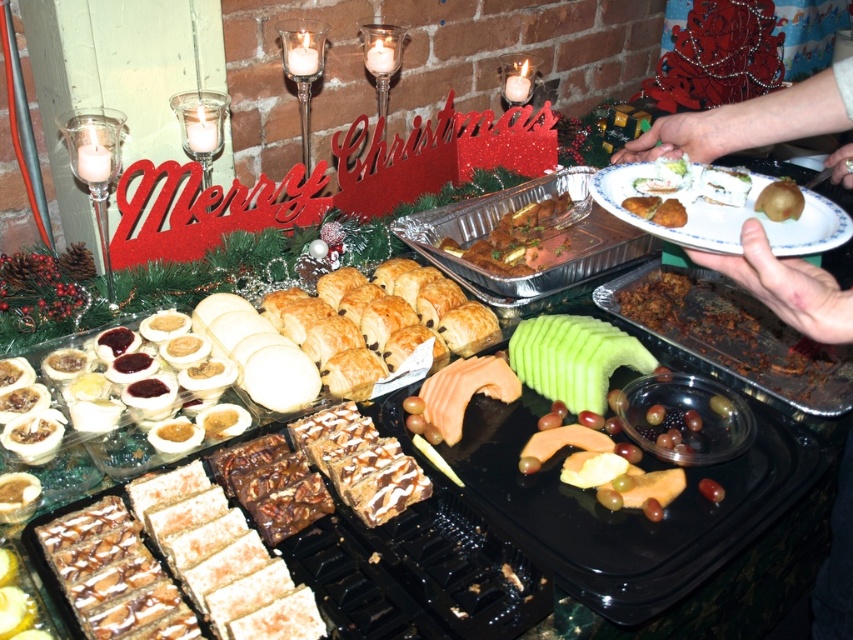
Can you confirm if smooth white plate at center is bigger than green matte kiwi at center?

Yes.

How distant is smooth white plate at center from green matte kiwi at center?

They are 4.58 inches apart.

Locate an element on the screen. smooth white plate at center is located at coordinates (750, 122).

Find the location of a particular element. Image resolution: width=853 pixels, height=640 pixels. white glossy plate at upper right is located at coordinates (724, 216).

Does white glossy plate at upper right have a smaller size compared to golden brown meat at center?

Yes.

Is point (817, 225) less distant than point (529, 224)?

Yes, it is in front of point (529, 224).

The image size is (853, 640). I want to click on white glossy plate at upper right, so click(724, 216).

At what (x,y) coordinates should I click in order to perform the action: click on smooth skin hand at upper right. Please return your answer as a coordinate pair (x, y). The image size is (853, 640). Looking at the image, I should click on pos(751,120).

Between point (743, 108) and point (724, 234), which one is positioned behind?

Point (743, 108)

Does point (815, 128) come closer to viewer compared to point (836, 211)?

No, (815, 128) is further to viewer.

The height and width of the screenshot is (640, 853). Find the location of `smooth skin hand at upper right`. smooth skin hand at upper right is located at coordinates (751, 120).